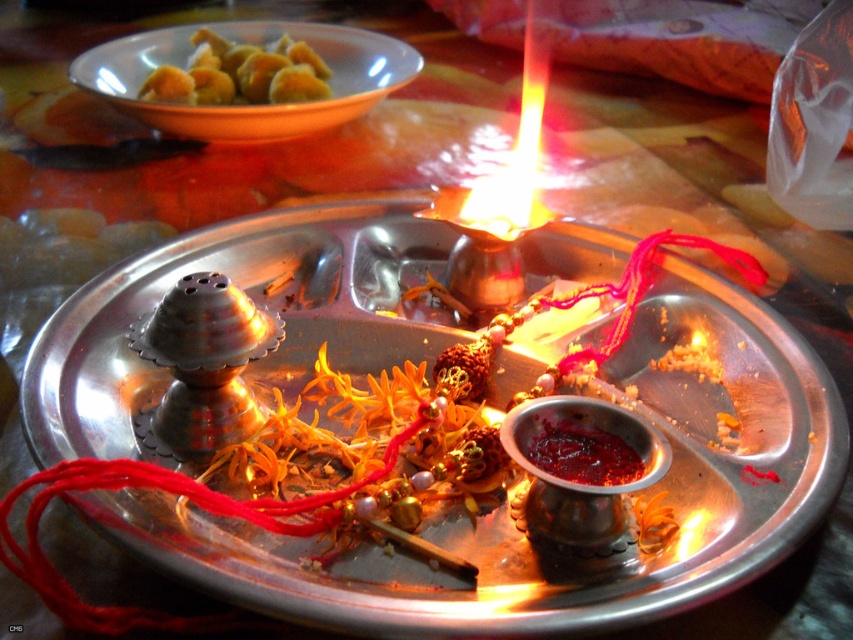
Does metallic tray at center come in front of golden fried dumplings at upper left?

Yes, metallic tray at center is in front of golden fried dumplings at upper left.

Who is more distant from viewer, (614, 560) or (247, 90)?

The point (247, 90) is behind.

Which is in front, point (836, 428) or point (155, 83)?

Point (836, 428)

Locate an element on the screen. metallic tray at center is located at coordinates (521, 534).

Which is behind, point (300, 42) or point (560, 460)?

The point (300, 42) is behind.

Can you confirm if golden fried dumplings at upper left is smaller than shiny red paste at center?

No, golden fried dumplings at upper left is not smaller than shiny red paste at center.

Who is more distant from viewer, (202, 28) or (567, 460)?

The point (202, 28) is behind.

Identify the location of golden fried dumplings at upper left. (241, 74).

From the picture: Who is lower down, metallic tray at center or shiny red paste at center?

shiny red paste at center

Does metallic tray at center appear on the right side of shiny red paste at center?

No, metallic tray at center is not to the right of shiny red paste at center.

Is point (776, 518) behind point (543, 419)?

No, it is not.

Where is `metallic tray at center`? The height and width of the screenshot is (640, 853). metallic tray at center is located at coordinates (521, 534).